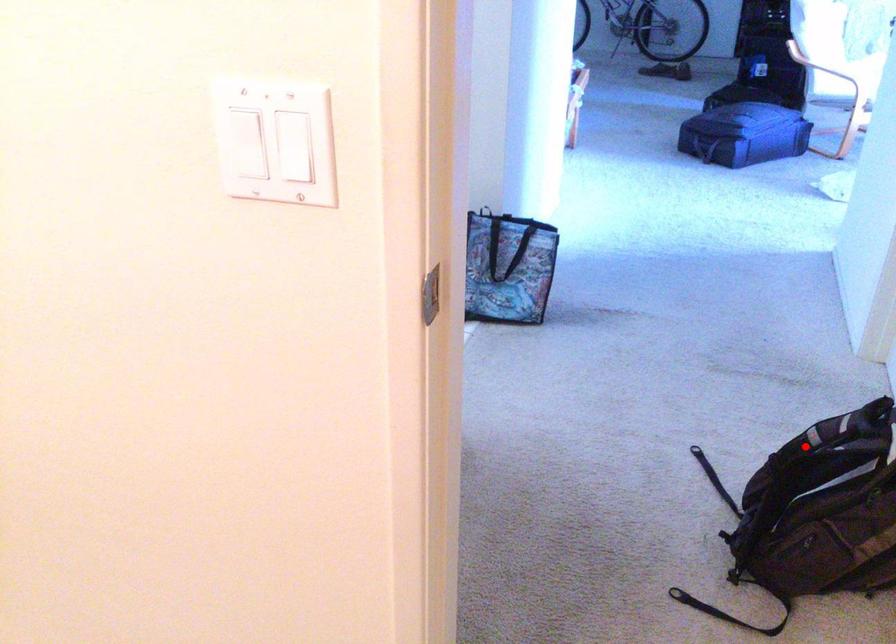
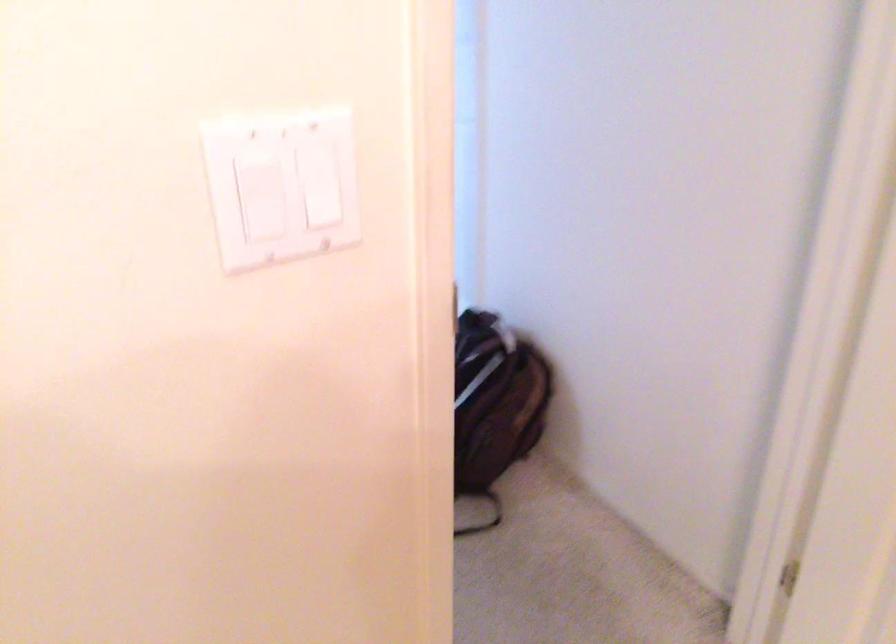
Question: I am providing you with two images of the same scene from different viewpoints. A red point is marked on the first image. At the location where the point appears in image 1, is it still visible in image 2?

Choices:
 (A) Yes
 (B) No

Answer: (B)